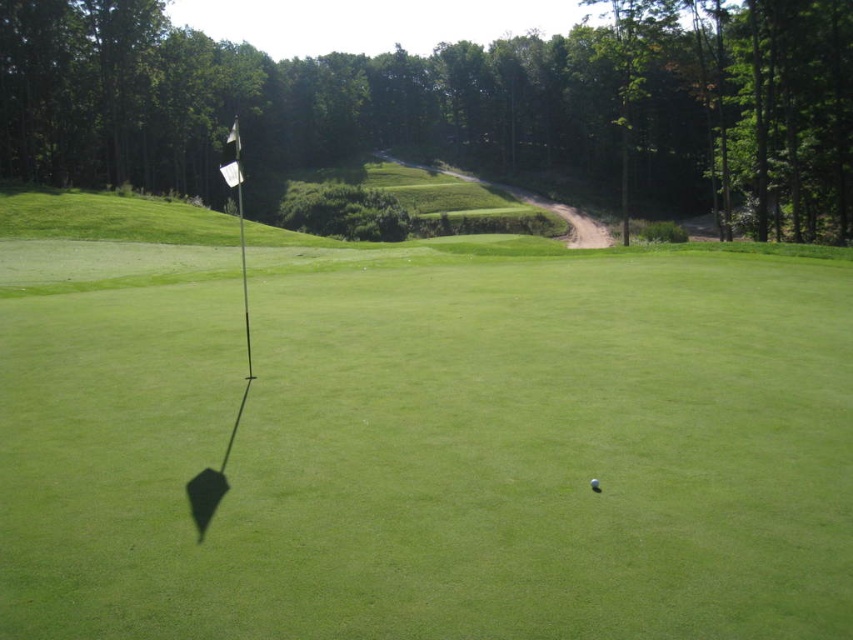
You are standing at the position marked by the coordinates point 0.5, 0.5. You want to walk to the green grassy golf course at center. In which direction should you move?

The green grassy golf course at center is located at point (425,444). Since you are at point (426,320), you should move northeast to reach it.

You are a golfer standing on the green grassy golf course at center, aiming to hit the white matte golf ball at center. The hole is 17 meters away. Will you be able to make the putt?

The distance between the green grassy golf course at center and the white matte golf ball at center is 17.14 meters. Since the hole is 17 meters away, the ball is slightly further than the target distance, so you might need to adjust your shot for a longer putt.